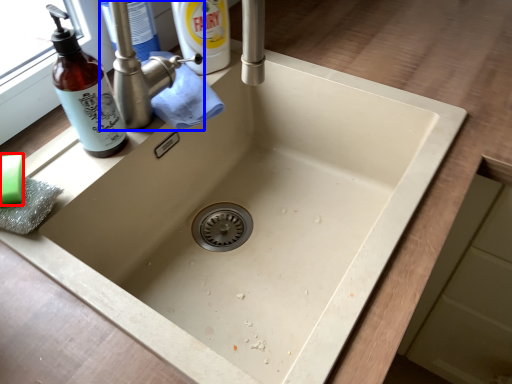
Question: Which object is further to the camera taking this photo, soap (highlighted by a red box) or tap (highlighted by a blue box)?

Choices:
 (A) soap
 (B) tap

Answer: (B)